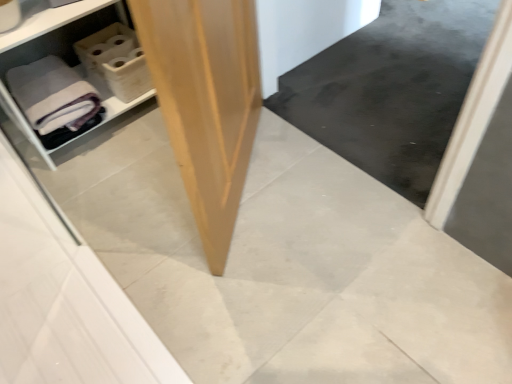
Find the location of `gray matte bath towel at left`. gray matte bath towel at left is located at coordinates (53, 95).

You are a GUI agent. You are given a task and a screenshot of the screen. Output one action in this format:
    pyautogui.click(x=<x>, y=<y>)
    Task: Click on the light brown plywood at center
    
    Given the screenshot: What is the action you would take?
    pyautogui.click(x=206, y=102)

Image resolution: width=512 pixels, height=384 pixels. Describe the element at coordinates (51, 23) in the screenshot. I see `white plastic shelf at left` at that location.

In order to face white plastic shelf at left, should I rotate leftwards or rightwards?

Turn left by 23.381 degrees to look at white plastic shelf at left.

You are a GUI agent. You are given a task and a screenshot of the screen. Output one action in this format:
    pyautogui.click(x=<x>, y=<y>)
    Task: Click on the gray matte bath towel at left
    The width and height of the screenshot is (512, 384).
    Given the screenshot: What is the action you would take?
    pyautogui.click(x=53, y=95)

Which is correct: light brown plywood at center is inside gray matte bath towel at left, or outside of it?

light brown plywood at center is outside gray matte bath towel at left.

From a real-world perspective, between light brown plywood at center and gray matte bath towel at left, who is vertically lower?

gray matte bath towel at left.

The height and width of the screenshot is (384, 512). Find the location of `bath towel above the light brown plywood at center (from the image's perspective)`. bath towel above the light brown plywood at center (from the image's perspective) is located at coordinates (53, 95).

Can you confirm if light brown plywood at center is thinner than gray matte bath towel at left?

Yes, light brown plywood at center is thinner than gray matte bath towel at left.

Between gray matte bath towel at left and light brown plywood at center, which one has smaller width?

light brown plywood at center.

Image resolution: width=512 pixels, height=384 pixels. I want to click on bath towel behind the light brown plywood at center, so [x=53, y=95].

Are white plastic shelf at left and light brown plywood at center making contact?

No, white plastic shelf at left is not beside light brown plywood at center.

Considering the sizes of white plastic shelf at left and light brown plywood at center in the image, is white plastic shelf at left taller or shorter than light brown plywood at center?

In the image, white plastic shelf at left appears to be shorter than light brown plywood at center.

Is white plastic shelf at left behind light brown plywood at center?

Yes, white plastic shelf at left is behind light brown plywood at center.

From a real-world perspective, is white plastic shelf at left located higher than light brown plywood at center?

Incorrect, from a real-world perspective, white plastic shelf at left is lower than light brown plywood at center.

Could you tell me if gray matte bath towel at left is turned towards white plastic shelf at left?

Yes, gray matte bath towel at left is aimed at white plastic shelf at left.

How distant is gray matte bath towel at left from white plastic shelf at left?

gray matte bath towel at left is 4.90 inches away from white plastic shelf at left.

Which of these two, gray matte bath towel at left or white plastic shelf at left, is wider?

gray matte bath towel at left is wider.

Considering their positions, is gray matte bath towel at left located in front of or behind white plastic shelf at left?

gray matte bath towel at left is behind white plastic shelf at left.

Which is nearer, [243,0] or [83,4]?

Clearly, point [243,0] is closer to the camera than point [83,4].

From the image's perspective, which is below, light brown plywood at center or white plastic shelf at left?

light brown plywood at center, from the image's perspective.

Is light brown plywood at center facing away from white plastic shelf at left?

That's right, light brown plywood at center is facing away from white plastic shelf at left.

In the image, is white plastic shelf at left on the left side or the right side of gray matte bath towel at left?

In the image, white plastic shelf at left appears on the right side of gray matte bath towel at left.

Is the position of white plastic shelf at left more distant than that of gray matte bath towel at left?

No.

Does white plastic shelf at left touch gray matte bath towel at left?

No, white plastic shelf at left is not with gray matte bath towel at left.

You are a GUI agent. You are given a task and a screenshot of the screen. Output one action in this format:
    pyautogui.click(x=<x>, y=<y>)
    Task: Click on the plywood below the gray matte bath towel at left (from the image's perspective)
    This screenshot has width=512, height=384.
    Given the screenshot: What is the action you would take?
    pyautogui.click(x=206, y=102)

There is a gray matte bath towel at left. At what (x,y) coordinates should I click in order to perform the action: click on plywood above it (from a real-world perspective). Please return your answer as a coordinate pair (x, y). Looking at the image, I should click on (206, 102).

Which object lies further to the anchor point gray matte bath towel at left, light brown plywood at center or white plastic shelf at left?

light brown plywood at center is further to gray matte bath towel at left.

From the image, which object appears to be farther from light brown plywood at center, gray matte bath towel at left or white plastic shelf at left?

white plastic shelf at left is positioned further to the anchor light brown plywood at center.

Considering their positions, is light brown plywood at center positioned closer to white plastic shelf at left than gray matte bath towel at left?

The object closer to white plastic shelf at left is gray matte bath towel at left.

Based on their spatial positions, is white plastic shelf at left or light brown plywood at center further from gray matte bath towel at left?

light brown plywood at center is positioned further to the anchor gray matte bath towel at left.

Based on their spatial positions, is gray matte bath towel at left or light brown plywood at center further from white plastic shelf at left?

light brown plywood at center lies further to white plastic shelf at left than the other object.

Which object lies nearer to the anchor point light brown plywood at center, white plastic shelf at left or gray matte bath towel at left?

gray matte bath towel at left is positioned closer to the anchor light brown plywood at center.

Find the location of `shelf between gray matte bath towel at left and light brown plywood at center in the horizontal direction`. shelf between gray matte bath towel at left and light brown plywood at center in the horizontal direction is located at coordinates tap(51, 23).